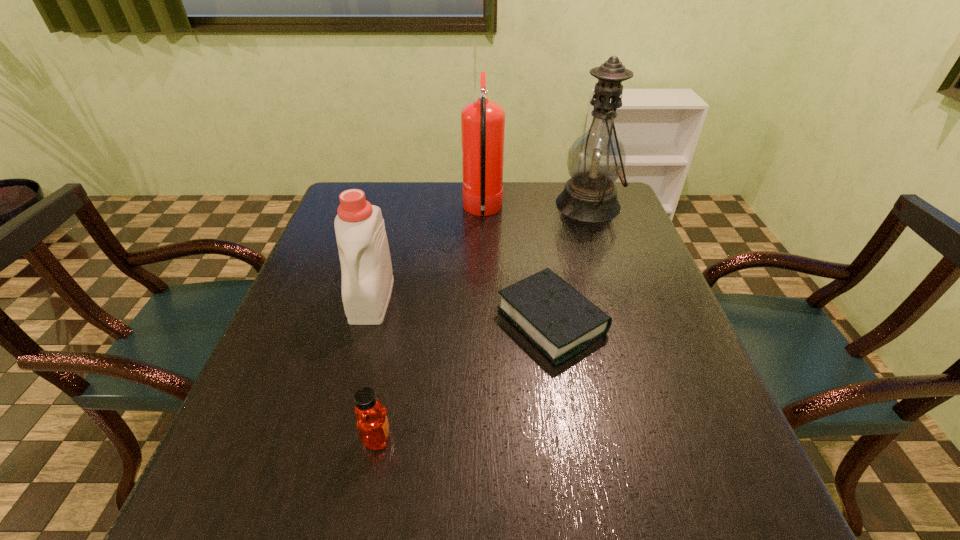
I want to click on vacant region between the Bible and the honey, so coord(465,379).

The image size is (960, 540). What are the coordinates of `free space that is in between the oil lamp and the leftmost object` in the screenshot? It's located at (480, 252).

Image resolution: width=960 pixels, height=540 pixels. I want to click on blank region between the fire extinguisher and the shortest object, so click(x=517, y=266).

Locate an element on the screen. Image resolution: width=960 pixels, height=540 pixels. vacant space that's between the third tallest object and the fire extinguisher is located at coordinates (427, 255).

In order to click on free space between the detergent and the Bible in this screenshot , I will do pyautogui.click(x=462, y=310).

Where is `object that stands as the third closest to the oil lamp`? object that stands as the third closest to the oil lamp is located at coordinates (367, 278).

Locate which object ranks second in proximity to the Bible. Please provide its 2D coordinates. Your answer should be formatted as a tuple, i.e. [(x, y)], where the tuple contains the x and y coordinates of a point satisfying the conditions above.

[(372, 424)]

Where is `free space that satisfies the following two spatial constraints: 1. towards the nozzle of the fire extinguisher; 2. on the handle side of the leftmost object`? free space that satisfies the following two spatial constraints: 1. towards the nozzle of the fire extinguisher; 2. on the handle side of the leftmost object is located at coordinates (484, 299).

Image resolution: width=960 pixels, height=540 pixels. In order to click on vacant space that satisfies the following two spatial constraints: 1. towards the nozzle of the shortest object; 2. on the left side of the fire extinguisher in this screenshot , I will do `click(484, 321)`.